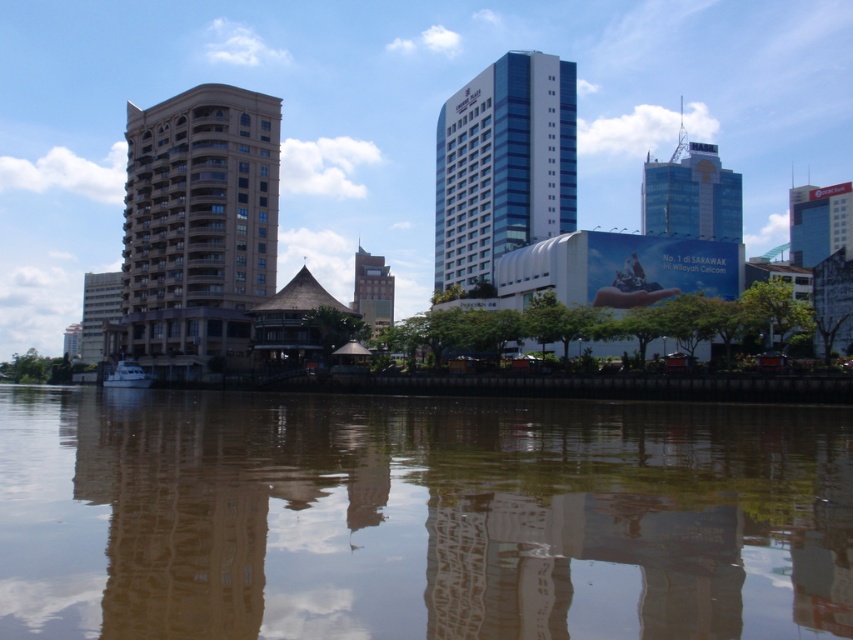
Question: Can you confirm if beige stone building at center is thinner than blue glass building at upper center?

Choices:
 (A) yes
 (B) no

Answer: (A)

Question: Is beige stone building at center further to the viewer compared to white matte boat at lower left?

Choices:
 (A) no
 (B) yes

Answer: (A)

Question: Which object is positioned closest to the white matte boat at lower left?

Choices:
 (A) beige stone building at center
 (B) blue glass building at upper right
 (C) transparent water at center
 (D) green glass tower at center

Answer: (A)

Question: Among these points, which one is farthest from the camera?

Choices:
 (A) (560, 211)
 (B) (387, 285)

Answer: (B)

Question: Is beige stone building at center positioned in front of blue glassy building at center?

Choices:
 (A) yes
 (B) no

Answer: (A)

Question: Among these objects, which one is nearest to the camera?

Choices:
 (A) beige stone building at center
 (B) green glass tower at center

Answer: (B)